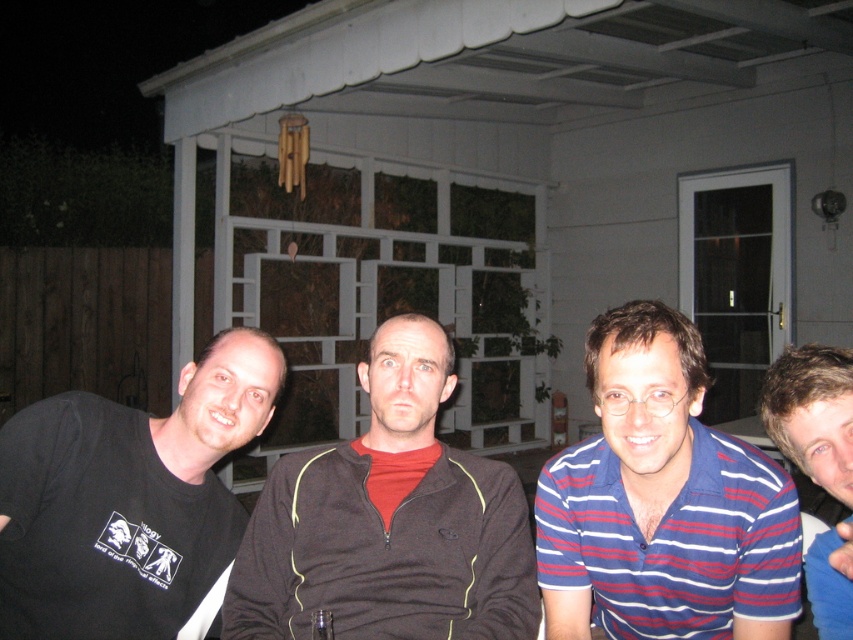
You are a photographer at the event and want to ensure both blue striped shirt at center and blue striped shirt at right are visible in the photo. Which shirt should you focus on to capture both without cropping either?

You should focus on the blue striped shirt at right since it is smaller in width compared to the blue striped shirt at center, allowing both to fit within the frame without cropping.